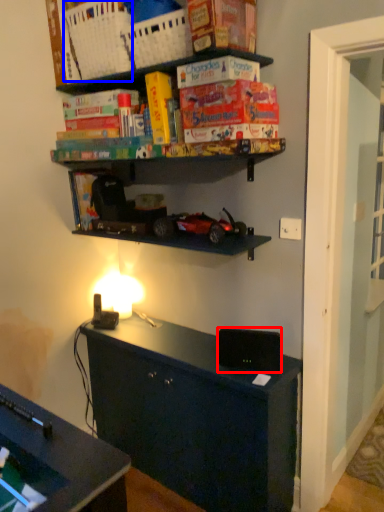
Question: Which object appears farthest to the camera in this image, speaker (highlighted by a red box) or basket (highlighted by a blue box)?

Choices:
 (A) speaker
 (B) basket

Answer: (A)